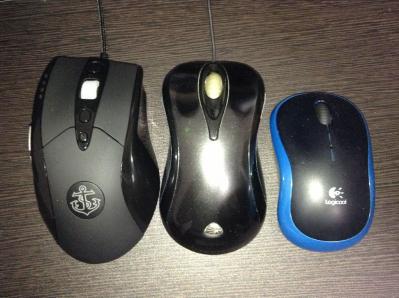
Find the location of `light reflection on mouse`. light reflection on mouse is located at coordinates 215,170.